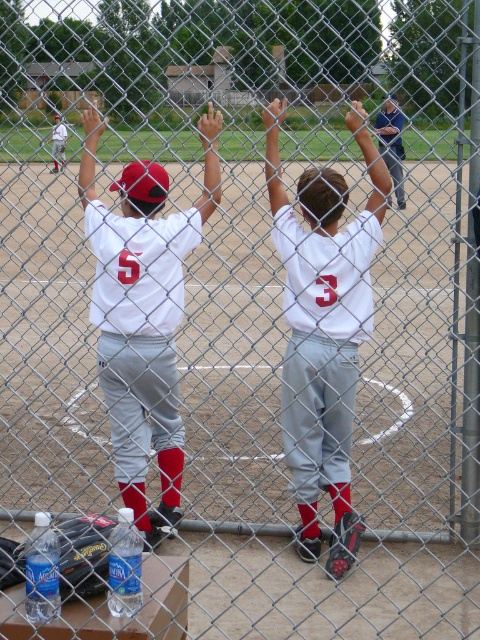
Is white matte jersey at center thinner than white jersey at center?

No.

How distant is white matte jersey at center from white jersey at center?

white matte jersey at center and white jersey at center are 56.89 centimeters apart from each other.

Who is more distant from viewer, (338, 518) or (97, 362)?

Point (97, 362)

Where is `white matte jersey at center`? The height and width of the screenshot is (640, 480). white matte jersey at center is located at coordinates (324, 330).